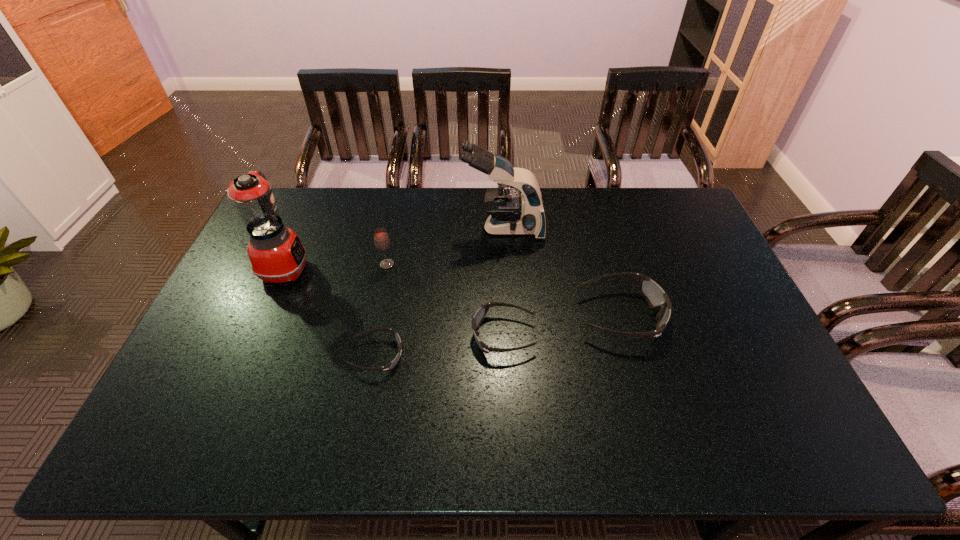
Locate an element on the screen. The image size is (960, 540). free space between the second sunglasses from right to left and the tallest sunglasses is located at coordinates (562, 326).

Identify the location of vacant region between the third tallest object and the leftmost object. The width and height of the screenshot is (960, 540). (336, 266).

Locate an element on the screen. The height and width of the screenshot is (540, 960). free space between the third tallest object and the rightmost sunglasses is located at coordinates (504, 290).

Image resolution: width=960 pixels, height=540 pixels. What are the coordinates of `empty location between the tallest sunglasses and the fourth shortest object` in the screenshot? It's located at (504, 290).

Locate an element on the screen. vacant space that's between the rightmost object and the farthest object is located at coordinates (562, 272).

At what (x,y) coordinates should I click in order to perform the action: click on free spot between the leftmost object and the leftmost sunglasses. Please return your answer as a coordinate pair (x, y). Looking at the image, I should click on (331, 312).

Where is `object that stands as the third closest to the microscope`? The image size is (960, 540). object that stands as the third closest to the microscope is located at coordinates (482, 311).

Identify which object is the second nearest to the rightmost object. Please provide its 2D coordinates. Your answer should be formatted as a tuple, i.e. [(x, y)], where the tuple contains the x and y coordinates of a point satisfying the conditions above.

[(509, 214)]

Where is `sunglasses identified as the third closest to the farthest object`? The image size is (960, 540). sunglasses identified as the third closest to the farthest object is located at coordinates (390, 365).

Select which sunglasses appears as the second closest to the leftmost object. Please provide its 2D coordinates. Your answer should be formatted as a tuple, i.e. [(x, y)], where the tuple contains the x and y coordinates of a point satisfying the conditions above.

[(482, 311)]